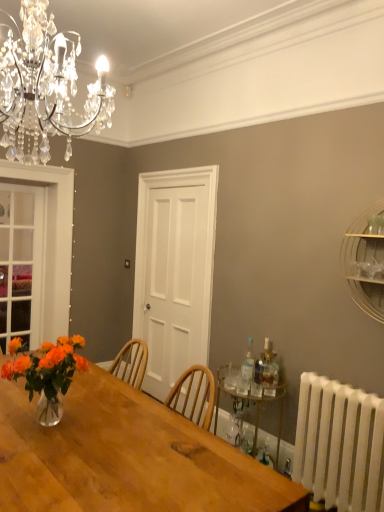
Question: Considering the relative sizes of white plastic radiator at lower right and white wooden door at center in the image provided, is white plastic radiator at lower right shorter than white wooden door at center?

Choices:
 (A) yes
 (B) no

Answer: (A)

Question: Is white plastic radiator at lower right turned away from white wooden door at center?

Choices:
 (A) yes
 (B) no

Answer: (B)

Question: Could you tell me if white plastic radiator at lower right is facing white wooden door at center?

Choices:
 (A) yes
 (B) no

Answer: (B)

Question: Considering the relative sizes of white plastic radiator at lower right and white wooden door at center in the image provided, is white plastic radiator at lower right taller than white wooden door at center?

Choices:
 (A) no
 (B) yes

Answer: (A)

Question: From the image's perspective, is white plastic radiator at lower right beneath white wooden door at center?

Choices:
 (A) yes
 (B) no

Answer: (A)

Question: Can you confirm if white plastic radiator at lower right is thinner than white wooden door at center?

Choices:
 (A) yes
 (B) no

Answer: (B)

Question: Is gold metallic bar cart at lower right, arranged as the second shelf when viewed from the front, positioned beyond the bounds of metallic gold shelf at upper right, which is the first shelf in top-to-bottom order?

Choices:
 (A) yes
 (B) no

Answer: (A)

Question: From a real-world perspective, is gold metallic bar cart at lower right, acting as the second shelf starting from the right, beneath metallic gold shelf at upper right, which ranks as the 2th shelf in bottom-to-top order?

Choices:
 (A) yes
 (B) no

Answer: (A)

Question: Would you say gold metallic bar cart at lower right, marked as the 1th shelf in a bottom-to-top arrangement, contains metallic gold shelf at upper right, which ranks as the 2th shelf in bottom-to-top order?

Choices:
 (A) no
 (B) yes

Answer: (A)

Question: Is metallic gold shelf at upper right, marked as the second shelf in a back-to-front arrangement, at the back of gold metallic bar cart at lower right, which ranks as the first shelf in left-to-right order?

Choices:
 (A) yes
 (B) no

Answer: (B)

Question: Is gold metallic bar cart at lower right, the 1th shelf from the back, at the left side of metallic gold shelf at upper right, which is the first shelf in top-to-bottom order?

Choices:
 (A) yes
 (B) no

Answer: (A)

Question: Is the depth of gold metallic bar cart at lower right, acting as the second shelf starting from the right, greater than that of metallic gold shelf at upper right, which ranks as the 2th shelf in bottom-to-top order?

Choices:
 (A) no
 (B) yes

Answer: (B)

Question: From the image's perspective, is gold metallic bar cart at lower right, acting as the second shelf starting from the right, beneath white plastic radiator at lower right?

Choices:
 (A) yes
 (B) no

Answer: (B)